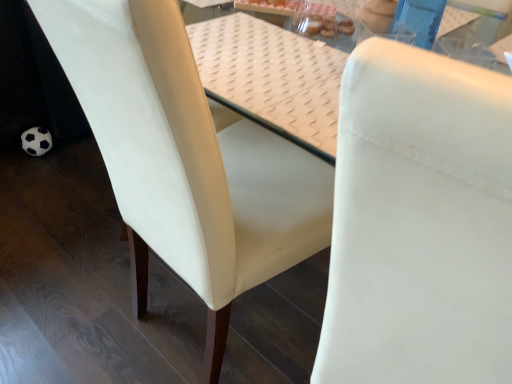
Question: Visually, is white textured table at center positioned to the left or to the right of white leather chair at center, acting as the 1th chair starting from the left?

Choices:
 (A) left
 (B) right

Answer: (B)

Question: From the image's perspective, relative to white leather chair at center, placed as the 2th chair when sorted from right to left, is white textured table at center above or below?

Choices:
 (A) below
 (B) above

Answer: (B)

Question: Which is nearer to the white leather chair at center, acting as the 1th chair starting from the left?

Choices:
 (A) white leather chair at center, the second chair positioned from the left
 (B) white textured table at center

Answer: (B)

Question: Which is nearer to the white leather chair at center, the second chair positioned from the left?

Choices:
 (A) white leather chair at center, placed as the 2th chair when sorted from right to left
 (B) white textured table at center

Answer: (A)